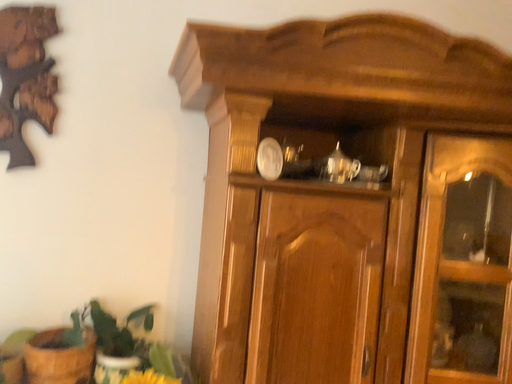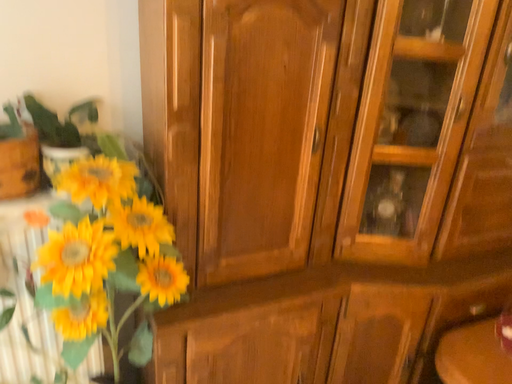
Question: How did the camera likely rotate when shooting the video?

Choices:
 (A) rotated downward
 (B) rotated upward

Answer: (A)